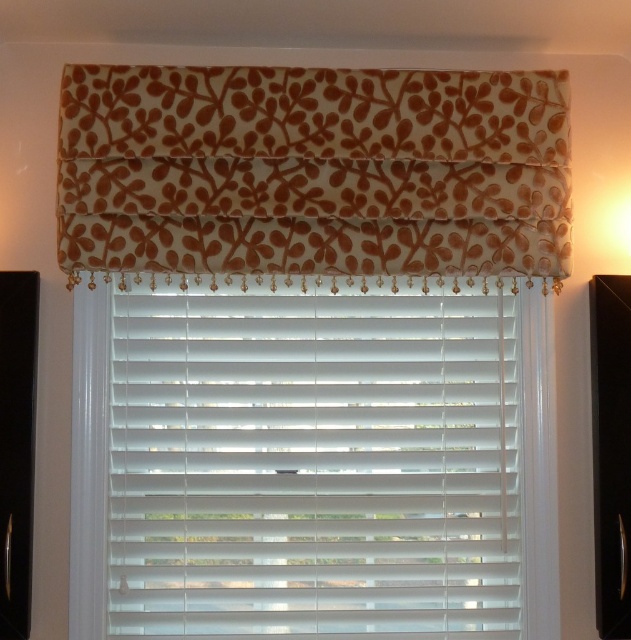
Is white matte blinds at center taller than brown floral fabric valance at upper center?

Yes.

Who is shorter, white matte blinds at center or brown floral fabric valance at upper center?

brown floral fabric valance at upper center is shorter.

This screenshot has width=631, height=640. What do you see at coordinates (312, 465) in the screenshot?
I see `white matte blinds at center` at bounding box center [312, 465].

Locate an element on the screen. Image resolution: width=631 pixels, height=640 pixels. white matte blinds at center is located at coordinates (312, 465).